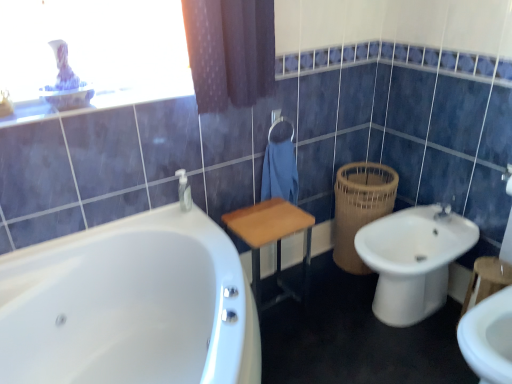
Locate an element on the screen. free area in between wooden table at center and woven brown basket at right is located at coordinates pyautogui.click(x=321, y=281).